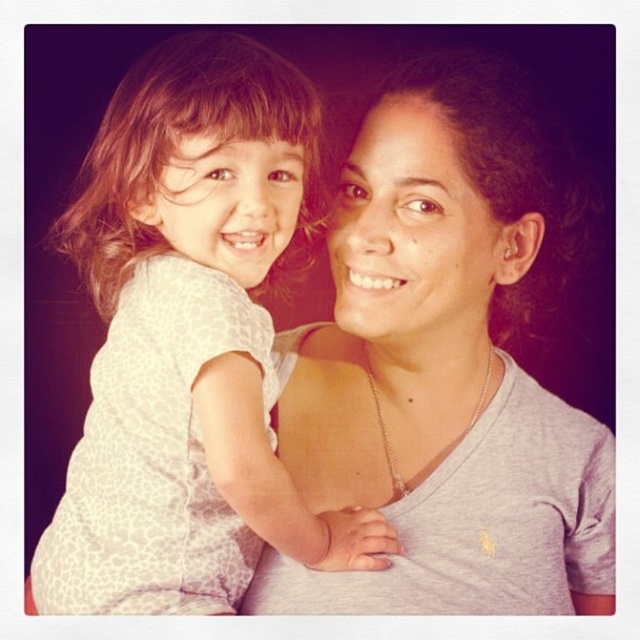
You are standing in a room and see two shirts in front of you. The gray matte shirt at center and the white leopard print shirt at upper left. Which shirt is closer to you?

The gray matte shirt at center is closer to you because it is further to the viewer than the white leopard print shirt at upper left.

You are a fashion designer who needs to create a matching outfit for the two people in the image. Given the distance between the gray matte shirt at center and the white leopard print shirt at upper left, can you determine if the two shirts can be displayed side by side on a mannequin without overlapping?

The gray matte shirt at center and white leopard print shirt at upper left are 17.07 centimeters apart from each other, so they can be displayed side by side on a mannequin without overlapping as the distance between them is sufficient.

You are an AI analyzing the scene. The gray matte shirt at center is located at coordinates relative to the image. What are its coordinates?

The gray matte shirt at center is located at point (445, 364).